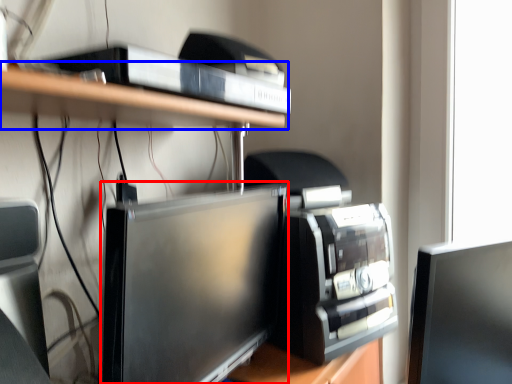
Question: Among these objects, which one is nearest to the camera, computer monitor (highlighted by a red box) or shelf (highlighted by a blue box)?

Choices:
 (A) computer monitor
 (B) shelf

Answer: (A)